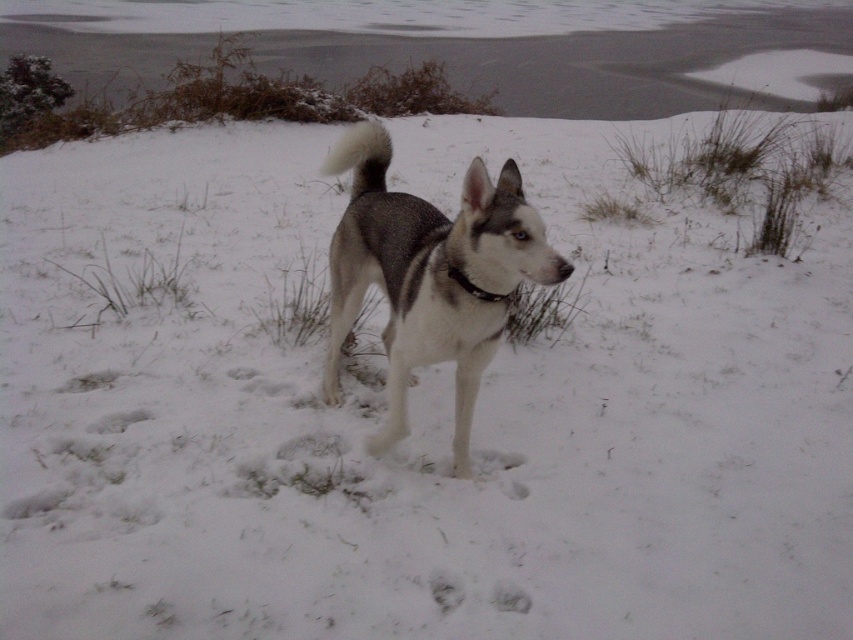
Is gray-white fur dog at center taller than black fabric neckband at center?

Indeed, gray-white fur dog at center has a greater height compared to black fabric neckband at center.

This screenshot has height=640, width=853. Identify the location of gray-white fur dog at center. (428, 275).